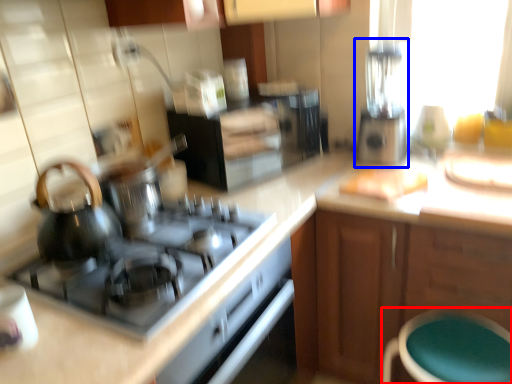
Question: Which point is further to the camera, bar stool (highlighted by a red box) or blender (highlighted by a blue box)?

Choices:
 (A) bar stool
 (B) blender

Answer: (B)